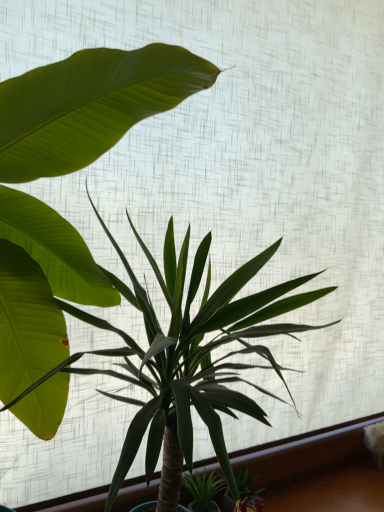
Question: Is green leafy plant at center, the 1th houseplant from the right, inside the boundaries of green leafy plant at lower center, or outside?

Choices:
 (A) inside
 (B) outside

Answer: (B)

Question: Considering the positions of green leafy plant at center, the 1th houseplant from the right, and green leafy plant at lower center in the image, is green leafy plant at center, the 1th houseplant from the right, bigger or smaller than green leafy plant at lower center?

Choices:
 (A) small
 (B) big

Answer: (B)

Question: Which of these objects is positioned closest to the green leafy plant at lower center?

Choices:
 (A) green leafy plant at center, the 1th houseplant from the right
 (B) green leafy plant at center, which is counted as the second houseplant, starting from the right

Answer: (A)

Question: Which object is the farthest from the green leafy plant at center, which is counted as the second houseplant, starting from the left?

Choices:
 (A) green leafy plant at lower center
 (B) green leafy plant at center, which appears as the first houseplant when viewed from the left

Answer: (A)